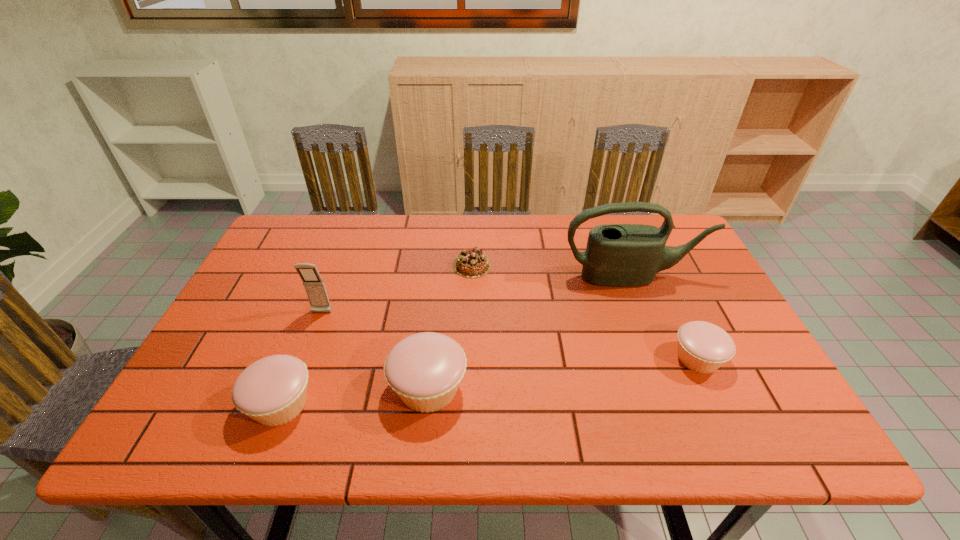
Identify the location of free space located on the left of the second cupcake from left to right. (326, 388).

Where is `vacant space positioned 0.140m on the left of the fifth tallest object`? vacant space positioned 0.140m on the left of the fifth tallest object is located at coordinates (612, 358).

Locate an element on the screen. free point located 0.370m on the right of the shortest object is located at coordinates (617, 266).

Where is `vacant space situated 0.060m on the spout of the watering can`? vacant space situated 0.060m on the spout of the watering can is located at coordinates (643, 303).

Find the location of a particular element. This screenshot has height=540, width=960. free space located on the front-facing side of the cellular telephone is located at coordinates (294, 387).

Locate an element on the screen. The image size is (960, 540). object that is at the far edge is located at coordinates (x=473, y=263).

Where is `object located in the left edge section of the desktop`? This screenshot has width=960, height=540. object located in the left edge section of the desktop is located at coordinates (273, 390).

Find the location of a particular element. This screenshot has width=960, height=540. cupcake positioned at the right edge is located at coordinates (703, 347).

This screenshot has height=540, width=960. Find the location of `watering can located in the right edge section of the desktop`. watering can located in the right edge section of the desktop is located at coordinates (621, 255).

Locate an element on the screen. The height and width of the screenshot is (540, 960). object located at the near left corner is located at coordinates (273, 390).